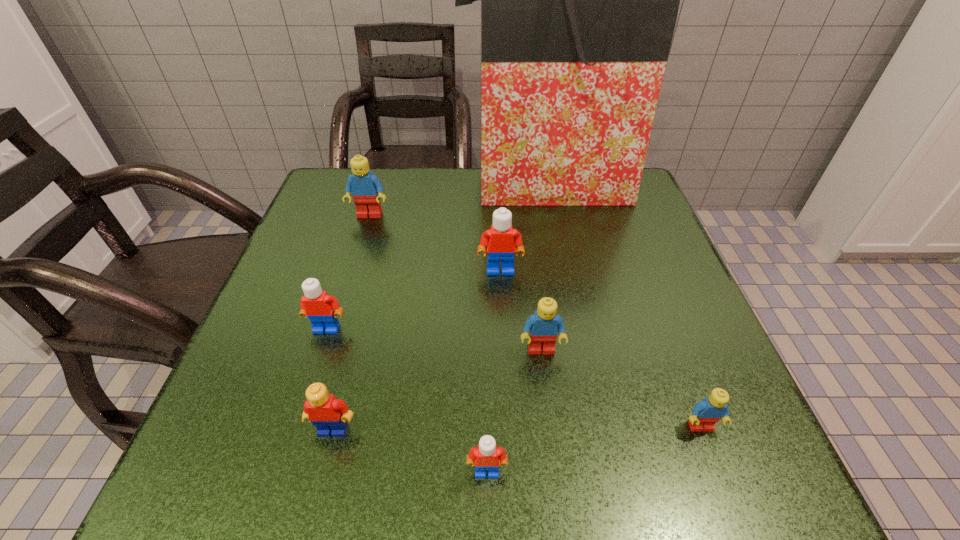
I want to click on Lego that is positioned at the far edge, so click(x=366, y=189).

Locate an element on the screen. The image size is (960, 540). shopping bag that is at the right edge is located at coordinates (579, 0).

This screenshot has width=960, height=540. What are the coordinates of `Lego that is at the right edge` in the screenshot? It's located at (706, 413).

Where is `object that is at the far left corner`? The height and width of the screenshot is (540, 960). object that is at the far left corner is located at coordinates (366, 189).

You are a GUI agent. You are given a task and a screenshot of the screen. Output one action in this format:
    pyautogui.click(x=<x>, y=<y>)
    Task: Click on the object at the near left corner
    This screenshot has height=540, width=960.
    Given the screenshot: What is the action you would take?
    pyautogui.click(x=328, y=414)

The width and height of the screenshot is (960, 540). I want to click on object that is at the far right corner, so click(579, 0).

The image size is (960, 540). Find the location of `object present at the near right corner`. object present at the near right corner is located at coordinates (706, 413).

The width and height of the screenshot is (960, 540). Find the location of `free space at the far edge`. free space at the far edge is located at coordinates (407, 200).

Find the location of `vacant space at the near edge`. vacant space at the near edge is located at coordinates (600, 468).

The image size is (960, 540). What are the coordinates of `vacant space at the left edge of the desktop` in the screenshot? It's located at (325, 222).